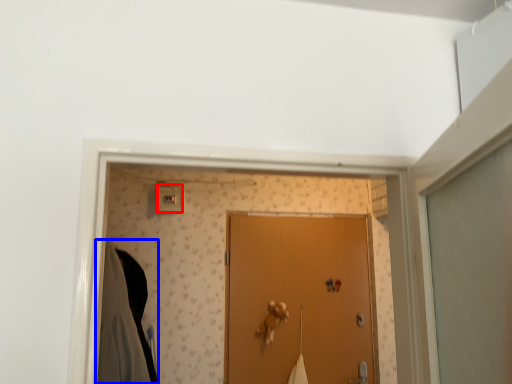
Question: Among these objects, which one is farthest to the camera, light switch (highlighted by a red box) or robe (highlighted by a blue box)?

Choices:
 (A) light switch
 (B) robe

Answer: (A)